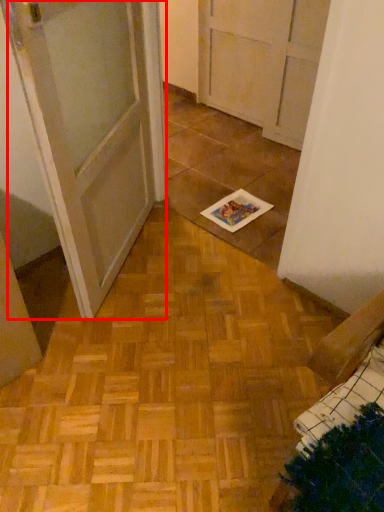
Question: Where is door (annotated by the red box) located in relation to book in the image?

Choices:
 (A) left
 (B) right

Answer: (A)